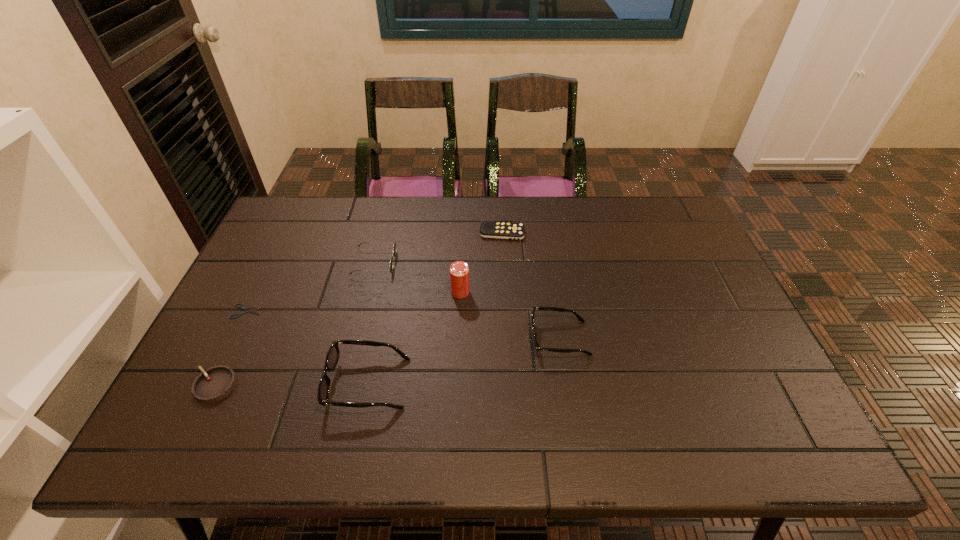
The image size is (960, 540). I want to click on beer can, so click(459, 271).

Identify the location of ashtray. This screenshot has width=960, height=540. (215, 383).

You are a GUI agent. You are given a task and a screenshot of the screen. Output one action in this format:
    pyautogui.click(x=<x>, y=<y>)
    Task: Click on the vacant region located on the lenses of the taller spectacles
    The width and height of the screenshot is (960, 540).
    Given the screenshot: What is the action you would take?
    pyautogui.click(x=203, y=383)

The image size is (960, 540). Identify the location of vacant space located 0.270m on the lenses of the taller spectacles. (215, 383).

Where is `vacant position located on the lenses of the taller spectacles`? vacant position located on the lenses of the taller spectacles is located at coordinates (194, 383).

Find the location of `vacant area located on the lenses of the third tallest object`. vacant area located on the lenses of the third tallest object is located at coordinates (384, 339).

Identify the location of vacant space situated on the lenses of the third tallest object. (396, 339).

Identify the location of vacant region located 0.400m on the lenses of the third tallest object. The image size is (960, 540). (376, 339).

Where is `vacant space located on the left of the farthest object`? vacant space located on the left of the farthest object is located at coordinates (382, 233).

Identify the location of blank area located on the right of the shortest object. The width and height of the screenshot is (960, 540). (280, 311).